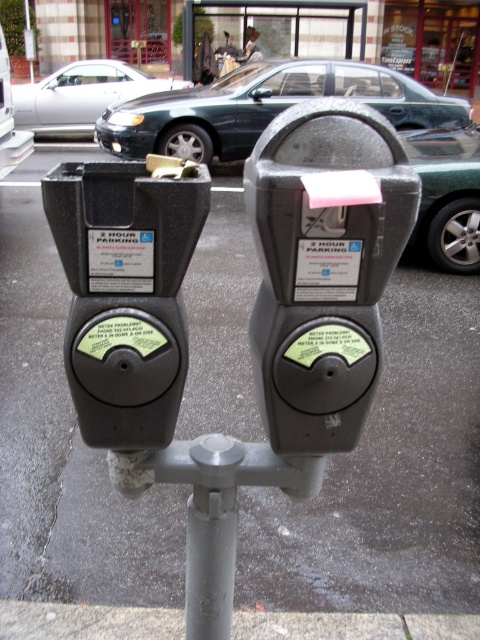
Is point (96, 276) positioned after point (192, 77)?

No, it is not.

Is matte black parking meter at left taller than metallic silver couple at center?

No, matte black parking meter at left is not taller than metallic silver couple at center.

At what (x,y) coordinates should I click in order to perform the action: click on matte black parking meter at left. Please return your answer as a coordinate pair (x, y). The height and width of the screenshot is (640, 480). Looking at the image, I should click on (124, 292).

Is matte black parking meter at center wider than silver metallic sedan at center?

No, matte black parking meter at center is not wider than silver metallic sedan at center.

Which of these two, matte black parking meter at center or silver metallic sedan at center, stands shorter?

Standing shorter between the two is matte black parking meter at center.

What are the coordinates of `matte black parking meter at center` in the screenshot? It's located at click(x=324, y=266).

Describe the element at coordinates (352, 625) in the screenshot. I see `gray concrete curb at lower center` at that location.

Is gray concrete curb at lower center below metallic silver couple at center?

Indeed, gray concrete curb at lower center is positioned under metallic silver couple at center.

This screenshot has height=640, width=480. I want to click on gray concrete curb at lower center, so click(x=352, y=625).

You are a GUI agent. You are given a task and a screenshot of the screen. Output one action in this format:
    pyautogui.click(x=<x>, y=<y>)
    Task: Click on the gray concrete curb at lower center
    This screenshot has width=480, height=640.
    Given the screenshot: What is the action you would take?
    pyautogui.click(x=352, y=625)